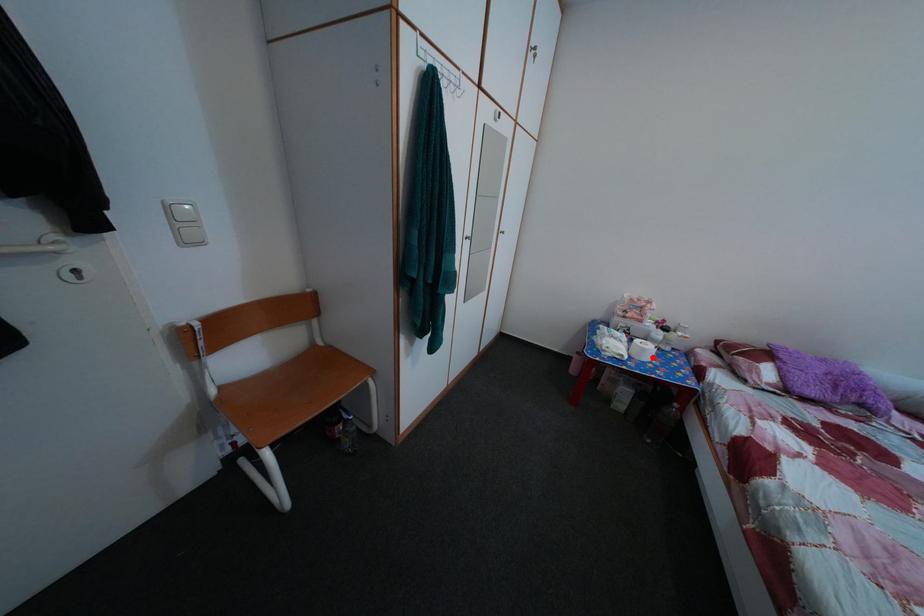
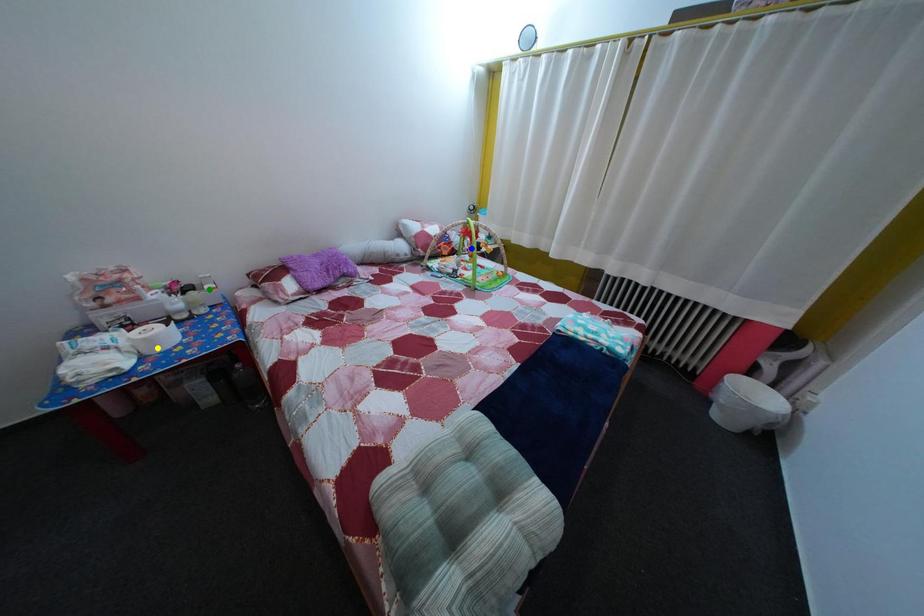
Question: I am providing you with two images of the same scene from different viewpoints. A red point is marked on the first image. You are given multiple points on the second image. Which point in image 2 represents the same 3d spot as the red point in image 1?

Choices:
 (A) green point
 (B) yellow point
 (C) blue point

Answer: (B)